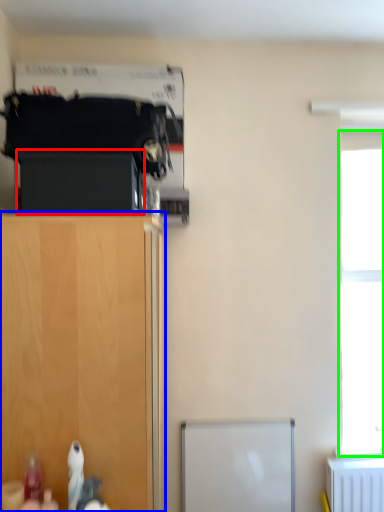
Question: Which object is the farthest from cabinetry (highlighted by a red box)? Choose among these: cupboard (highlighted by a blue box) or window (highlighted by a green box).

Choices:
 (A) cupboard
 (B) window

Answer: (B)